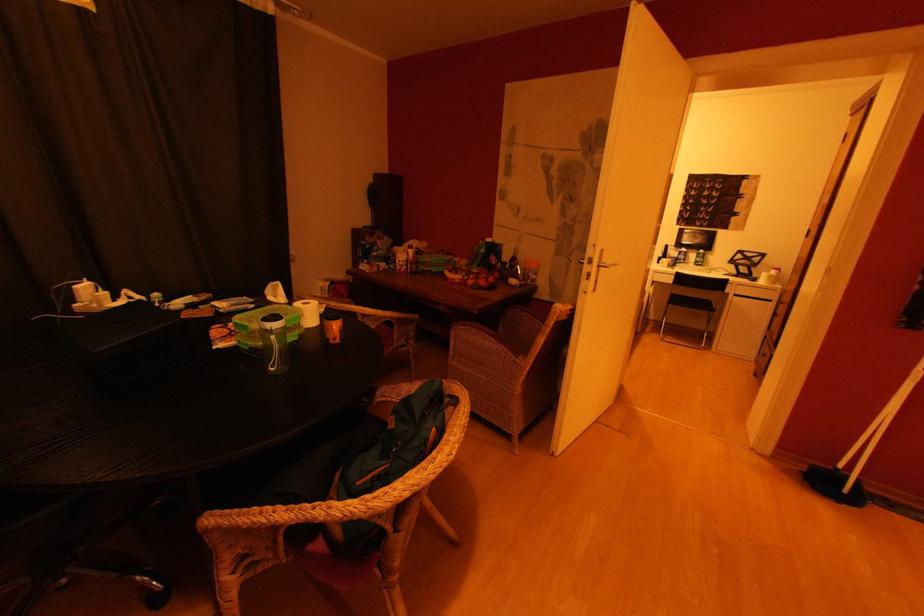
Find the location of `wicker chair armrest`. wicker chair armrest is located at coordinates (265, 511).